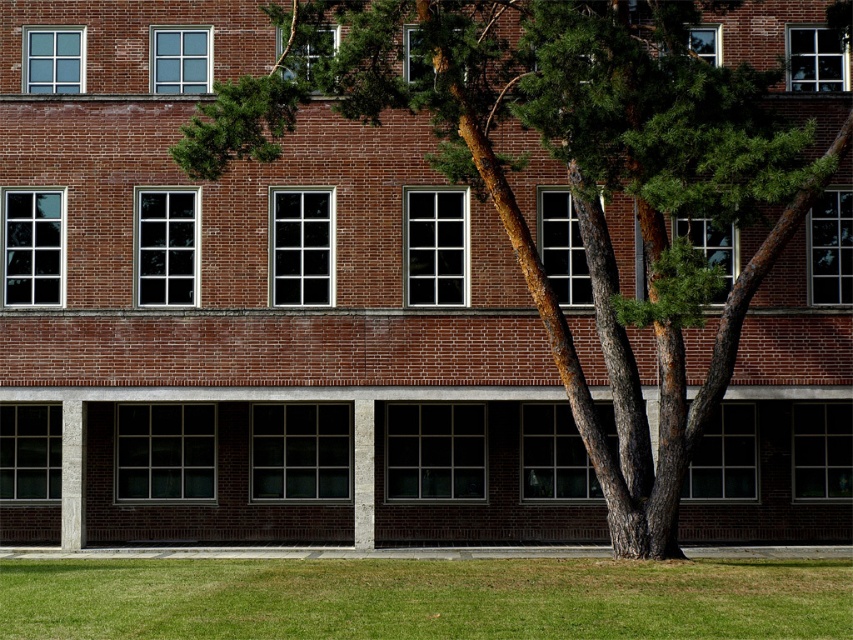
Question: Is green textured bark at center in front of green grass at lower center?

Choices:
 (A) no
 (B) yes

Answer: (A)

Question: Which point is closer to the camera?

Choices:
 (A) green grass at lower center
 (B) green textured bark at center

Answer: (A)

Question: From the image, what is the correct spatial relationship of green textured bark at center in relation to green grass at lower center?

Choices:
 (A) below
 (B) above

Answer: (B)

Question: Does green textured bark at center lie in front of green grass at lower center?

Choices:
 (A) yes
 (B) no

Answer: (B)